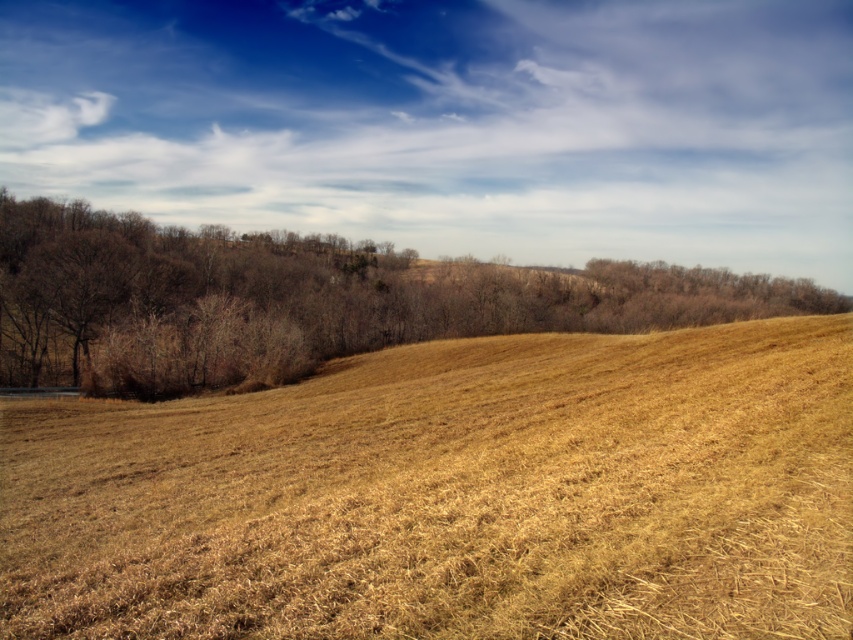
Question: Can you confirm if dry straw at center is positioned below brown leafless tree at center?

Choices:
 (A) no
 (B) yes

Answer: (B)

Question: Can you confirm if dry straw at center is smaller than brown leafless tree at center?

Choices:
 (A) yes
 (B) no

Answer: (A)

Question: Is dry straw at center behind brown leafless tree at center?

Choices:
 (A) no
 (B) yes

Answer: (A)

Question: Which point appears farthest from the camera in this image?

Choices:
 (A) (341, 296)
 (B) (753, 577)

Answer: (A)